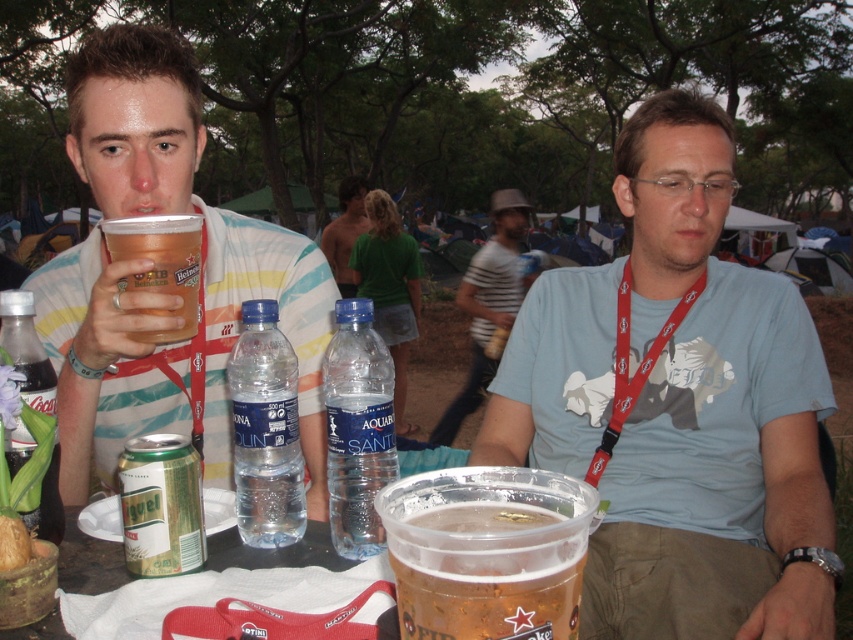
You are at a festival and need to grab a drink quickly. There are two options on the table in front of you, a green metallic can at lower left and a matte glass bottle at lower left. Which one is closer to your hand if your hand is currently positioned at the center of the table?

Both the green metallic can at lower left and the matte glass bottle at lower left are located at the lower left of the table. Since your hand is at the center, the distance to both items would depend on their exact positions. However, the question states they are 4.27 inches apart from each other, but it does not specify which one is closer to the center. Without additional information about their individual distances from the center, it is impossible to determine which is closer. Therefore, you would need

You are at a festival and see two cups on the table. The matte plastic cup at upper left and the translucent plastic cup at upper left. Which one is positioned more to the left?

The matte plastic cup at upper left is positioned more to the left than the translucent plastic cup at upper left.